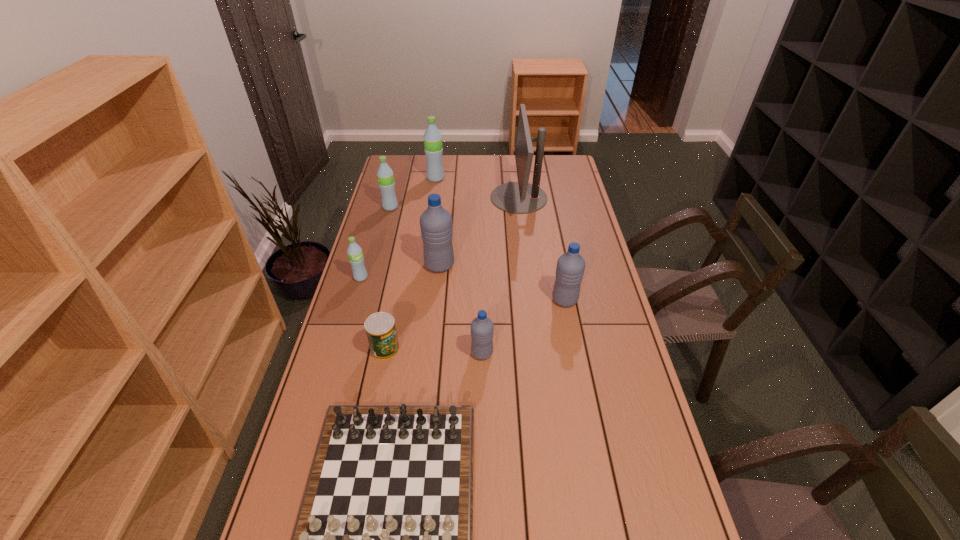
This screenshot has height=540, width=960. Identify the location of free point located 0.060m on the right of the nearest green water bottle. (384, 278).

I want to click on vacant space located 0.200m on the front of the fifth water bottle from left to right, so click(482, 423).

Where is `free spot located on the front of the can`? free spot located on the front of the can is located at coordinates (371, 424).

Identify the location of computer monitor situated at the far edge. The width and height of the screenshot is (960, 540). (521, 197).

Identify the location of water bottle at the far edge. (433, 148).

Image resolution: width=960 pixels, height=540 pixels. In order to click on can that is positioned at the left edge in this screenshot , I will do `click(380, 328)`.

The image size is (960, 540). What are the coordinates of `computer monitor that is positioned at the right edge` in the screenshot? It's located at (521, 197).

At what (x,y) coordinates should I click in order to perform the action: click on water bottle located at the right edge. Please return your answer as a coordinate pair (x, y). The width and height of the screenshot is (960, 540). Looking at the image, I should click on (570, 268).

Identify the location of object that is at the far right corner. (521, 197).

In the image, there is a desktop. Where is `vacant region at the far edge`? The width and height of the screenshot is (960, 540). vacant region at the far edge is located at coordinates (475, 176).